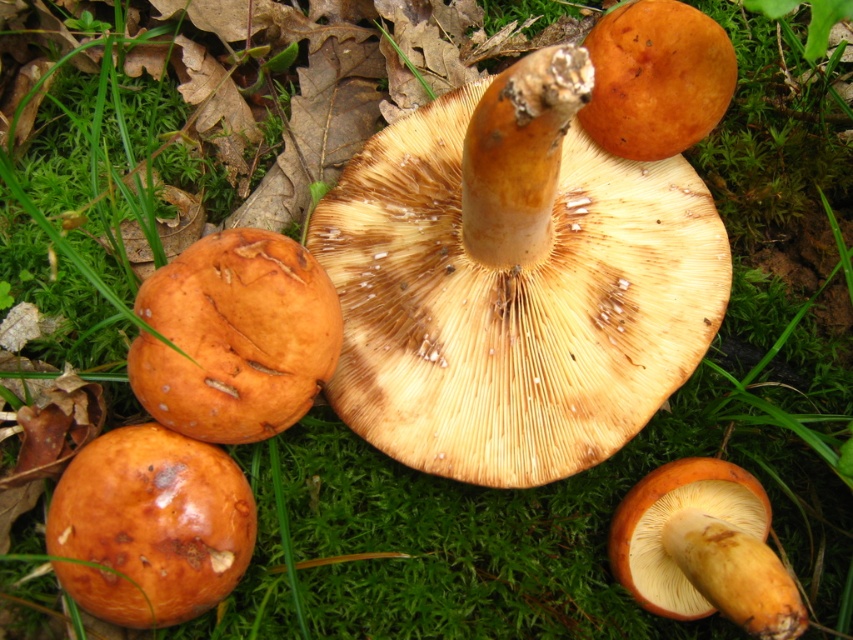
You are a mycologist examining two mushrooms in a forest. You see a matte brown mushroom at center and a glossy orange mushroom at center. Which one is more to the right?

The matte brown mushroom at center is positioned on the right side of the glossy orange mushroom at center, so it is more to the right.

You are a mycologist examining two mushrooms in the image. The scene shows a cluster of mushrooms on a mossy forest floor. You need to determine which mushroom has a wider cap. Which one is wider between the matte brown mushroom at center and the shiny brown mushroom at center?

The matte brown mushroom at center has a wider cap than the shiny brown mushroom at center.

You are a small animal that needs to jump from the shiny brown mushroom at center to the shiny orange cap at center. Can you make the jump if your maximum jump distance is 25 inches?

The distance between the shiny brown mushroom at center and the shiny orange cap at center is 26.11 inches, which is longer than your maximum jump distance of 25 inches. Therefore, you cannot make the jump.